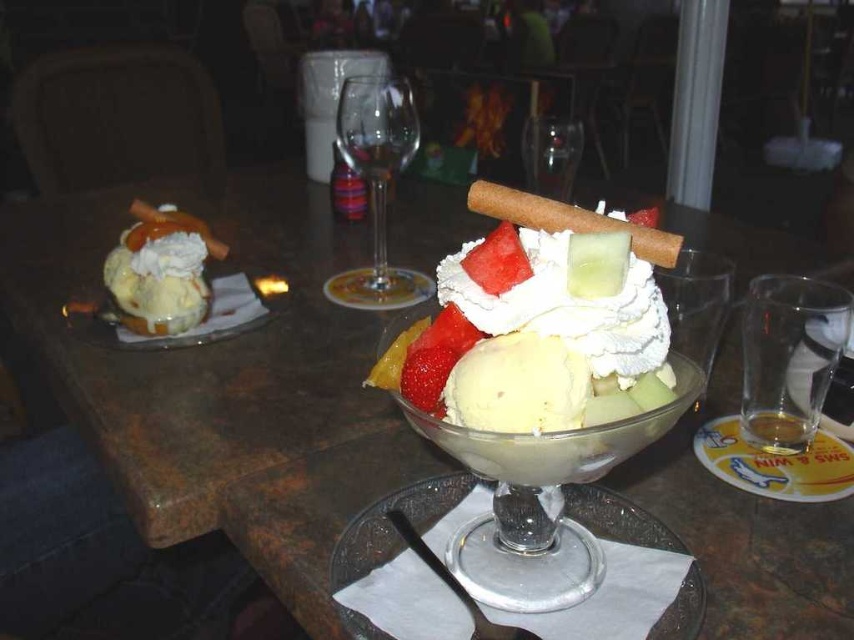
You are a customer at the dessert counter and want to choose between the two ice cream servings. The first is at point (x=291, y=486) and the second is at (x=502, y=250). Which one is closer to you?

The ice cream serving at point (x=291, y=486) is closer to you because it is further to the viewer than point (x=502, y=250).